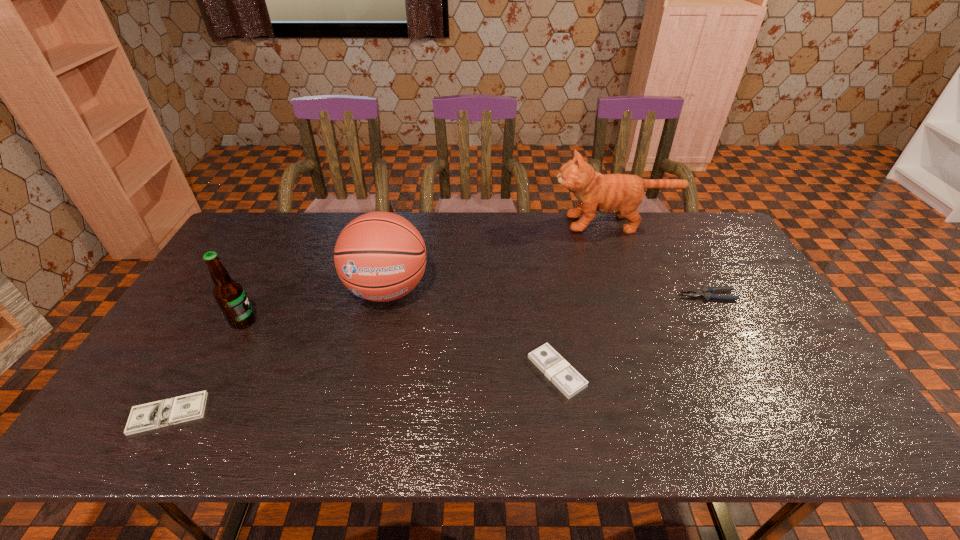
I want to click on free space between the left dollar and the fourth object from right to left, so click(x=278, y=352).

Identify the location of free space that is in between the fourth object from right to left and the beer bottle. The width and height of the screenshot is (960, 540). (315, 305).

Select which object is the fourth closest to the taller dollar. Please provide its 2D coordinates. Your answer should be formatted as a tuple, i.e. [(x, y)], where the tuple contains the x and y coordinates of a point satisfying the conditions above.

[(229, 294)]

At what (x,y) coordinates should I click in order to perform the action: click on object that is the fifth closest to the farthest object. Please return your answer as a coordinate pair (x, y). This screenshot has height=540, width=960. Looking at the image, I should click on (157, 414).

Find the location of a particular element. The height and width of the screenshot is (540, 960). vacant position in the image that satisfies the following two spatial constraints: 1. at the gripping part of the pliers; 2. on the front side of the right dollar is located at coordinates (750, 372).

Find the location of `vacant region that satisfies the following two spatial constraints: 1. on the face of the farthest object; 2. on the logo side of the basketball`. vacant region that satisfies the following two spatial constraints: 1. on the face of the farthest object; 2. on the logo side of the basketball is located at coordinates (639, 289).

The image size is (960, 540). I want to click on vacant region that satisfies the following two spatial constraints: 1. on the logo side of the fourth object from right to left; 2. on the label of the beer bottle, so click(x=380, y=321).